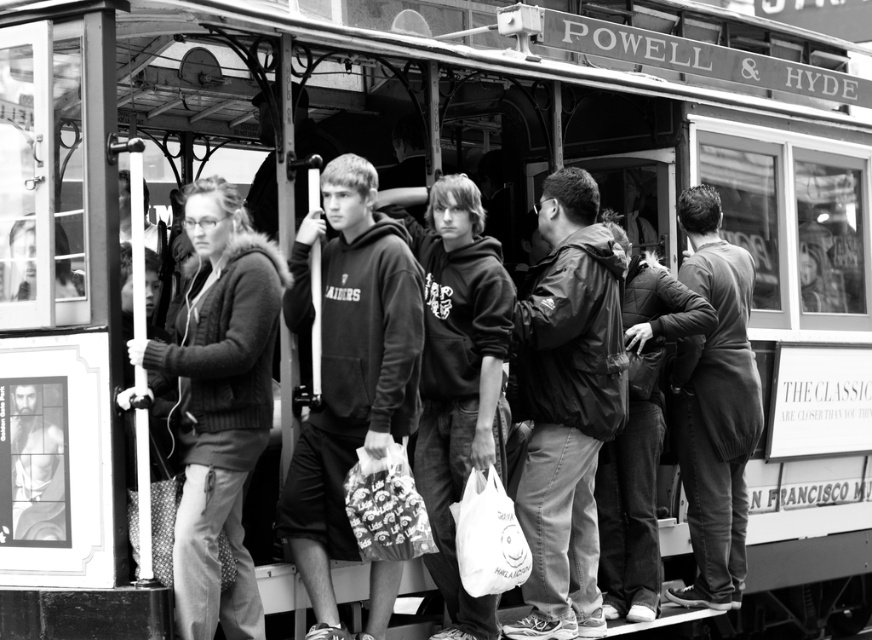
You are a photographer trying to capture a clear shot of the dark gray hoodie at center and the dark gray quilted jacket at center in the cable car scene. Since both items are dark gray, which one would appear more visible in your photo if you focus on the one that is closer to the camera?

The dark gray hoodie at center is positioned over dark gray quilted jacket at center, so focusing on the dark gray hoodie at center would make it more visible since it is closer to the camera.

You are a photographer trying to capture a candid shot of the matte black jacket at center and the matte black hoodie at center inside the cable car. Since both are at the center, which one is more to the right?

The matte black jacket at center is positioned on the right side of the matte black hoodie at center, so the matte black jacket at center is more to the right.